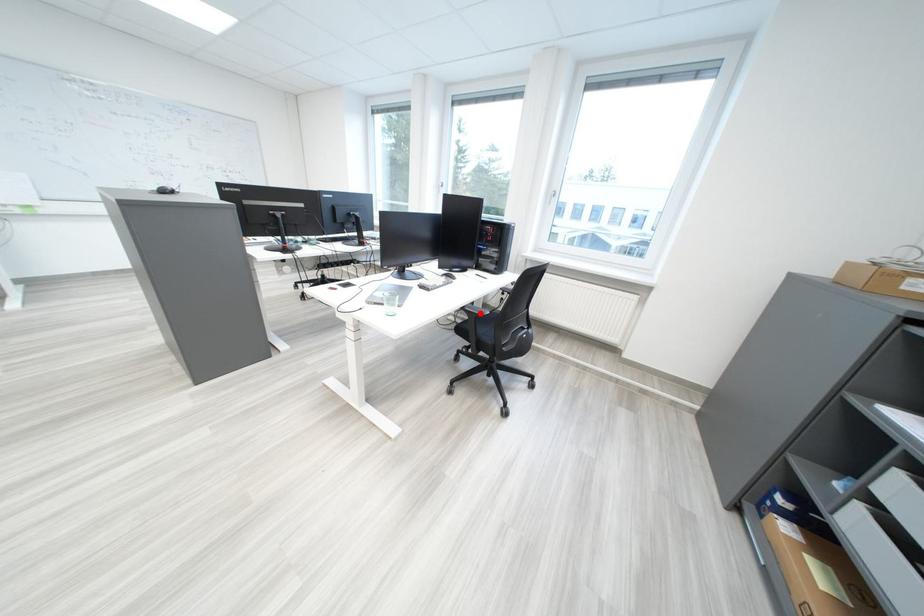
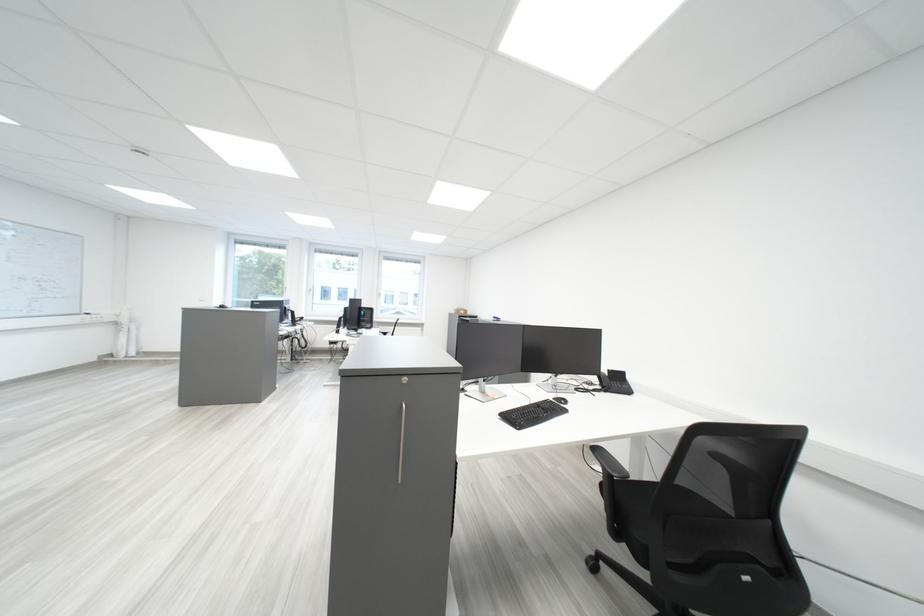
Question: I am providing you with two images of the same scene from different viewpoints. A red point is marked on the first image. Is the red point's position out of view in image 2?

Choices:
 (A) Yes
 (B) No

Answer: (A)